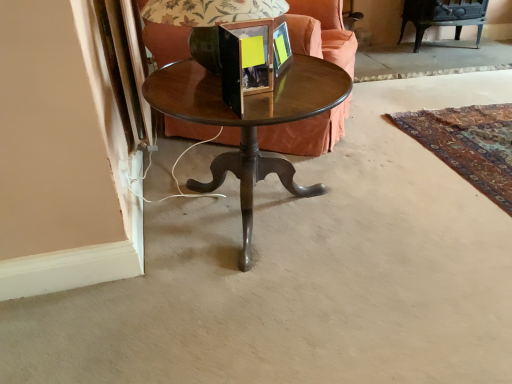
This screenshot has width=512, height=384. What do you see at coordinates (195, 21) in the screenshot? I see `matte black lampshade at center` at bounding box center [195, 21].

Measure the distance between point (282, 55) and camera.

The depth of point (282, 55) is 1.41 meters.

Locate an element on the screen. The image size is (512, 384). velvet orange couch at center is located at coordinates (321, 32).

Is velvet orange couch at center oriented towards matte black picture frame at upper center, the 2th picture frame positioned from the front?

No, velvet orange couch at center is not aimed at matte black picture frame at upper center, the 2th picture frame positioned from the front.

Can you confirm if velvet orange couch at center is thinner than matte black picture frame at upper center, the 2th picture frame positioned from the front?

In fact, velvet orange couch at center might be wider than matte black picture frame at upper center, the 2th picture frame positioned from the front.

Considering the relative sizes of velvet orange couch at center and matte black picture frame at upper center, the 2th picture frame positioned from the front, in the image provided, is velvet orange couch at center bigger than matte black picture frame at upper center, the 2th picture frame positioned from the front,?

Yes, velvet orange couch at center is bigger than matte black picture frame at upper center, the 2th picture frame positioned from the front.

From a real-world perspective, between velvet orange couch at center and matte black picture frame at upper center, marked as the first picture frame in a back-to-front arrangement, who is vertically lower?

In real-world perspective, velvet orange couch at center is lower.

From the image's perspective, is wooden round table at center on matte black picture frame at upper center, marked as the first picture frame in a back-to-front arrangement?

No, from the image's perspective, wooden round table at center is not over matte black picture frame at upper center, marked as the first picture frame in a back-to-front arrangement.

This screenshot has height=384, width=512. Find the location of `the 2nd picture frame above the wooden round table at center (from the image's perspective)`. the 2nd picture frame above the wooden round table at center (from the image's perspective) is located at coordinates (281, 49).

Considering the positions of objects wooden round table at center and matte black picture frame at upper center, the 2th picture frame positioned from the front, in the image provided, who is more to the right, wooden round table at center or matte black picture frame at upper center, the 2th picture frame positioned from the front,?

matte black picture frame at upper center, the 2th picture frame positioned from the front.

Does wooden picture frame at center, arranged as the 2th picture frame when viewed from the back, lie behind wooden round table at center?

No.

In terms of width, does wooden picture frame at center, arranged as the 2th picture frame when viewed from the back, look wider or thinner when compared to wooden round table at center?

Considering their sizes, wooden picture frame at center, arranged as the 2th picture frame when viewed from the back, looks slimmer than wooden round table at center.

From the image's perspective, which one is positioned higher, wooden picture frame at center, which is the 1th picture frame in front-to-back order, or wooden round table at center?

From the image's view, wooden picture frame at center, which is the 1th picture frame in front-to-back order, is above.

Consider the image. Is wooden picture frame at center, which is the 1th picture frame in front-to-back order, located within wooden round table at center?

Definitely not — wooden picture frame at center, which is the 1th picture frame in front-to-back order, is not inside wooden round table at center.

Is wooden round table at center not near wooden picture frame at center, which is the 1th picture frame in front-to-back order?

They are positioned close to each other.

Which of these two, wooden round table at center or wooden picture frame at center, arranged as the 2th picture frame when viewed from the back, is wider?

wooden round table at center.

Which is closer, (191, 84) or (183, 0)?

The point (183, 0) is in front.

Where is `table lamp above the wooden round table at center (from a real-world perspective)`? The image size is (512, 384). table lamp above the wooden round table at center (from a real-world perspective) is located at coordinates (195, 21).

Is wooden round table at center positioned beyond the bounds of matte black lampshade at center?

That's correct, wooden round table at center is outside of matte black lampshade at center.

Does wooden round table at center have a lesser height compared to matte black lampshade at center?

No.

Considering the sizes of objects velvet orange couch at center and wooden round table at center in the image provided, who is smaller, velvet orange couch at center or wooden round table at center?

Smaller between the two is wooden round table at center.

Which object is positioned more to the right, velvet orange couch at center or wooden round table at center?

velvet orange couch at center is more to the right.

Considering the positions of objects velvet orange couch at center and wooden round table at center in the image provided, who is in front, velvet orange couch at center or wooden round table at center?

wooden round table at center is more forward.

Considering the sizes of objects matte black lampshade at center and matte black picture frame at upper center, the 2th picture frame positioned from the front, in the image provided, who is wider, matte black lampshade at center or matte black picture frame at upper center, the 2th picture frame positioned from the front,?

Wider between the two is matte black lampshade at center.

Is matte black lampshade at center positioned with its back to matte black picture frame at upper center, the 2th picture frame positioned from the front?

No, matte black lampshade at center's orientation is not away from matte black picture frame at upper center, the 2th picture frame positioned from the front.

Which is behind, matte black lampshade at center or matte black picture frame at upper center, the 2th picture frame positioned from the front?

matte black picture frame at upper center, the 2th picture frame positioned from the front, is further away from the camera.

Could you measure the distance between matte black lampshade at center and matte black picture frame at upper center, marked as the first picture frame in a back-to-front arrangement?

28.87 centimeters.

Identify the location of the 1st picture frame below the velvet orange couch at center (from the image's perspective). Image resolution: width=512 pixels, height=384 pixels. (281, 49).

Find the location of a particular element. The height and width of the screenshot is (384, 512). picture frame that is behind the wooden round table at center is located at coordinates (281, 49).

Which object lies further to the anchor point wooden round table at center, wooden picture frame at center, arranged as the 2th picture frame when viewed from the back, or velvet orange couch at center?

velvet orange couch at center is further to wooden round table at center.

From the image, which object appears to be farther from velvet orange couch at center, matte black picture frame at upper center, the 2th picture frame positioned from the front, or matte black lampshade at center?

matte black lampshade at center lies further to velvet orange couch at center than the other object.

Estimate the real-world distances between objects in this image. Which object is further from wooden round table at center, matte black picture frame at upper center, the 2th picture frame positioned from the front, or velvet orange couch at center?

Based on the image, velvet orange couch at center appears to be further to wooden round table at center.

Considering their positions, is wooden picture frame at center, which is the 1th picture frame in front-to-back order, positioned closer to velvet orange couch at center than wooden round table at center?

wooden round table at center is closer to velvet orange couch at center.

Estimate the real-world distances between objects in this image. Which object is further from velvet orange couch at center, matte black lampshade at center or matte black picture frame at upper center, the 2th picture frame positioned from the front?

Based on the image, matte black lampshade at center appears to be further to velvet orange couch at center.

Looking at the image, which one is located closer to velvet orange couch at center, matte black lampshade at center or wooden picture frame at center, arranged as the 2th picture frame when viewed from the back?

The object closer to velvet orange couch at center is matte black lampshade at center.

Estimate the real-world distances between objects in this image. Which object is further from wooden round table at center, velvet orange couch at center or wooden picture frame at center, arranged as the 2th picture frame when viewed from the back?

velvet orange couch at center lies further to wooden round table at center than the other object.

Estimate the real-world distances between objects in this image. Which object is further from wooden picture frame at center, arranged as the 2th picture frame when viewed from the back, matte black picture frame at upper center, the 2th picture frame positioned from the front, or wooden round table at center?

Among the two, wooden round table at center is located further to wooden picture frame at center, arranged as the 2th picture frame when viewed from the back.

Where is `picture frame located between wooden picture frame at center, arranged as the 2th picture frame when viewed from the back, and velvet orange couch at center in the depth direction`? This screenshot has width=512, height=384. picture frame located between wooden picture frame at center, arranged as the 2th picture frame when viewed from the back, and velvet orange couch at center in the depth direction is located at coordinates (281, 49).

You are a GUI agent. You are given a task and a screenshot of the screen. Output one action in this format:
    pyautogui.click(x=<x>, y=<y>)
    Task: Click on the table lamp between velvet orange couch at center and wooden round table at center vertically
    
    Given the screenshot: What is the action you would take?
    pyautogui.click(x=195, y=21)

You are a GUI agent. You are given a task and a screenshot of the screen. Output one action in this format:
    pyautogui.click(x=<x>, y=<y>)
    Task: Click on the table lamp between wooden picture frame at center, which is the 1th picture frame in front-to-back order, and velvet orange couch at center, along the z-axis
    This screenshot has width=512, height=384.
    Given the screenshot: What is the action you would take?
    pyautogui.click(x=195, y=21)

Image resolution: width=512 pixels, height=384 pixels. Find the location of `table lamp between wooden picture frame at center, which is the 1th picture frame in front-to-back order, and matte black picture frame at upper center, the 2th picture frame positioned from the front, in the front-back direction`. table lamp between wooden picture frame at center, which is the 1th picture frame in front-to-back order, and matte black picture frame at upper center, the 2th picture frame positioned from the front, in the front-back direction is located at coordinates (195, 21).